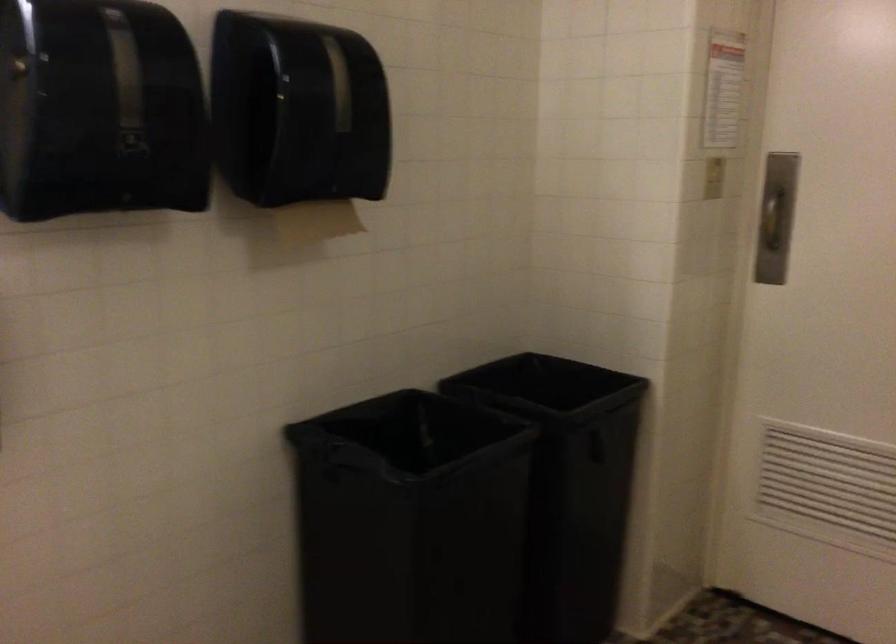
The width and height of the screenshot is (896, 644). What do you see at coordinates (713, 178) in the screenshot? I see `the light switch` at bounding box center [713, 178].